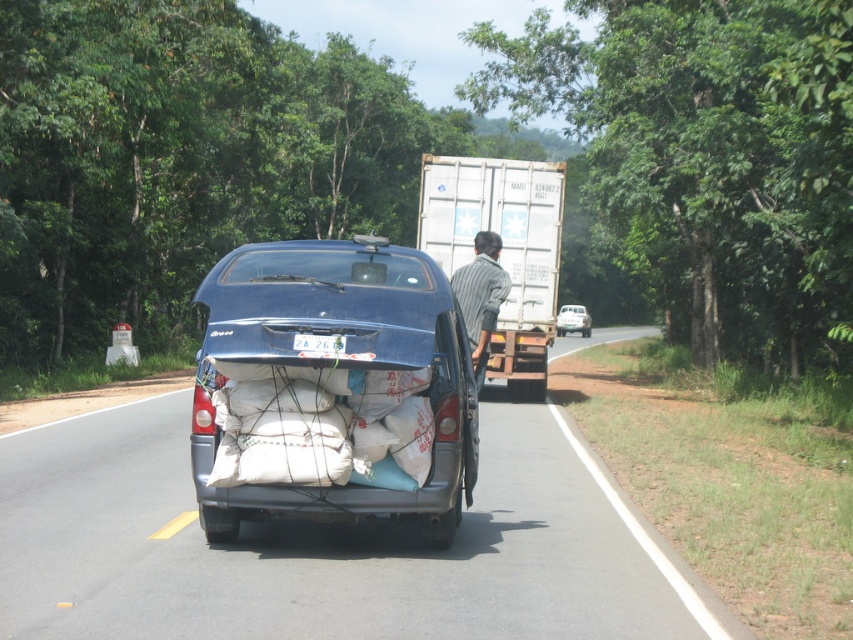
Is striped fabric shirt at center above metallic silver van at center?

No.

Is point (502, 284) positioned in front of point (561, 321)?

Yes, it is.

At what (x,y) coordinates should I click in order to perform the action: click on striped fabric shirt at center. Please return your answer as a coordinate pair (x, y). Looking at the image, I should click on (480, 296).

Which is in front, point (526, 241) or point (494, 269)?

Point (494, 269)

The height and width of the screenshot is (640, 853). What are the coordinates of `white matte container at center` in the screenshot? It's located at (502, 250).

Locate an element on the screen. white matte container at center is located at coordinates (502, 250).

Which is below, matte blue car at center or striped fabric shirt at center?

matte blue car at center

Where is `matte blue car at center`? matte blue car at center is located at coordinates tap(332, 388).

Between point (463, 492) and point (476, 285), which one is positioned in front?

Point (463, 492) is more forward.

Where is `matte blue car at center`? This screenshot has height=640, width=853. matte blue car at center is located at coordinates (332, 388).